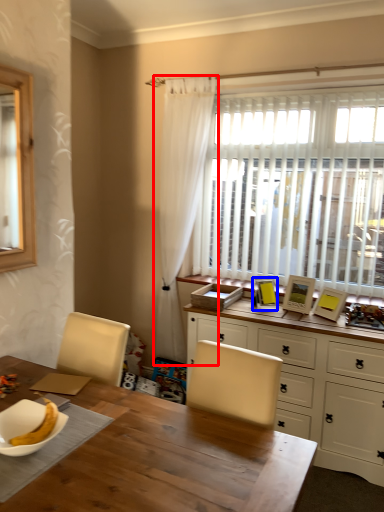
Question: Which object is further to the camera taking this photo, curtain (highlighted by a red box) or picture frame (highlighted by a blue box)?

Choices:
 (A) curtain
 (B) picture frame

Answer: (A)